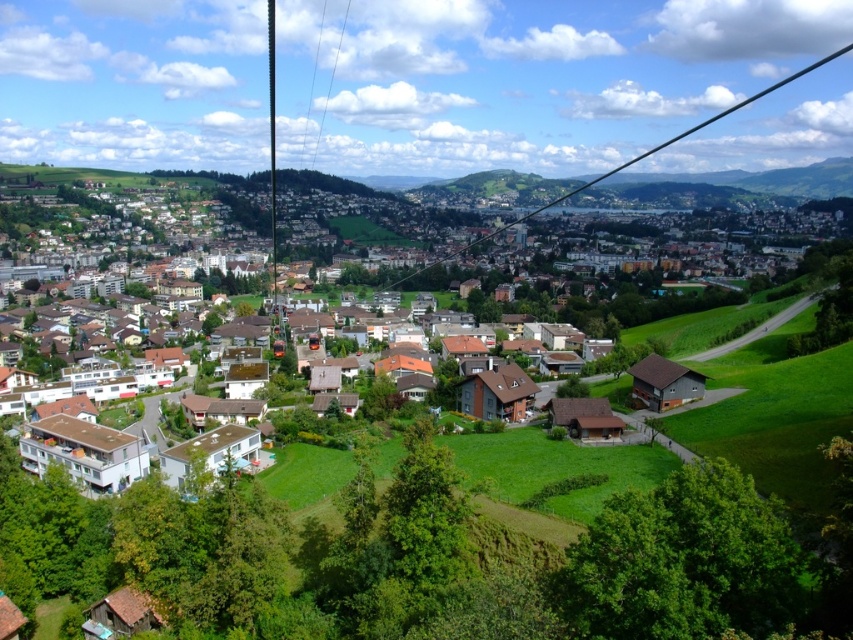
Question: Which of the following is the closest to the observer?

Choices:
 (A) (314, 465)
 (B) (604, 177)

Answer: (A)

Question: Does brown wooden houses at center appear on the right side of black wire at center?

Choices:
 (A) yes
 (B) no

Answer: (B)

Question: Which of the following is the closest to the observer?

Choices:
 (A) pos(508,221)
 (B) pos(808,445)

Answer: (B)

Question: Is brown wooden houses at center above black wire at center?

Choices:
 (A) no
 (B) yes

Answer: (A)

Question: Can you confirm if brown wooden houses at center is bigger than black wire at center?

Choices:
 (A) no
 (B) yes

Answer: (A)